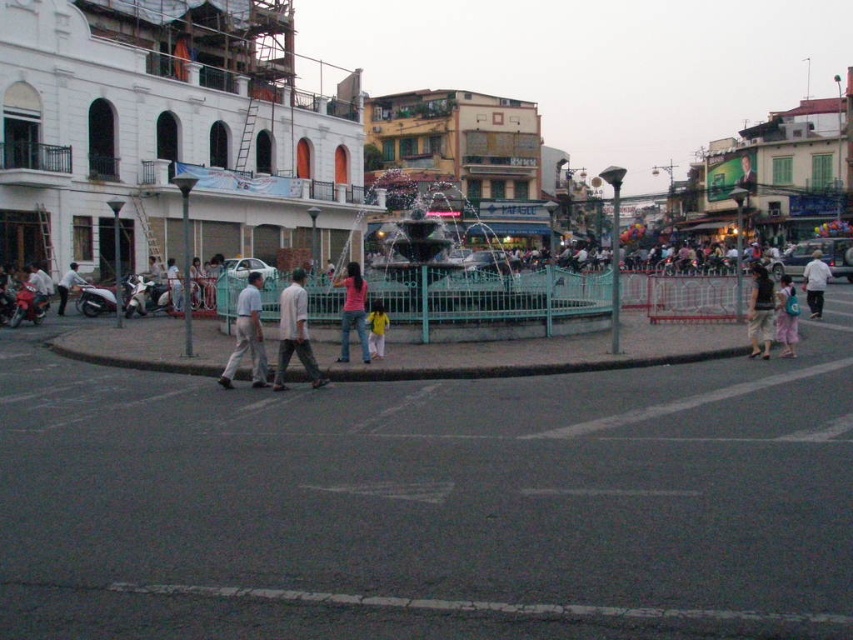
Which is above, pink fabric at center or dark gray fabric shirt at right?

pink fabric at center is above.

Can you confirm if pink fabric at center is taller than dark gray fabric shirt at right?

Yes, pink fabric at center is taller than dark gray fabric shirt at right.

What do you see at coordinates (352, 310) in the screenshot? I see `pink fabric at center` at bounding box center [352, 310].

Locate an element on the screen. pink fabric at center is located at coordinates (352, 310).

Can you confirm if gray matte pants at center is positioned above yellow matte shirt at center?

Correct, gray matte pants at center is located above yellow matte shirt at center.

Is point (236, 310) more distant than point (370, 349)?

Yes, point (236, 310) is farther from viewer.

What are the coordinates of `gray matte pants at center` in the screenshot? It's located at (247, 336).

Identify the location of gray matte pants at center. (247, 336).

Who is shorter, light brown cotton pants at center or pink fabric at center?

light brown cotton pants at center is shorter.

This screenshot has width=853, height=640. I want to click on light brown cotton pants at center, so click(x=294, y=332).